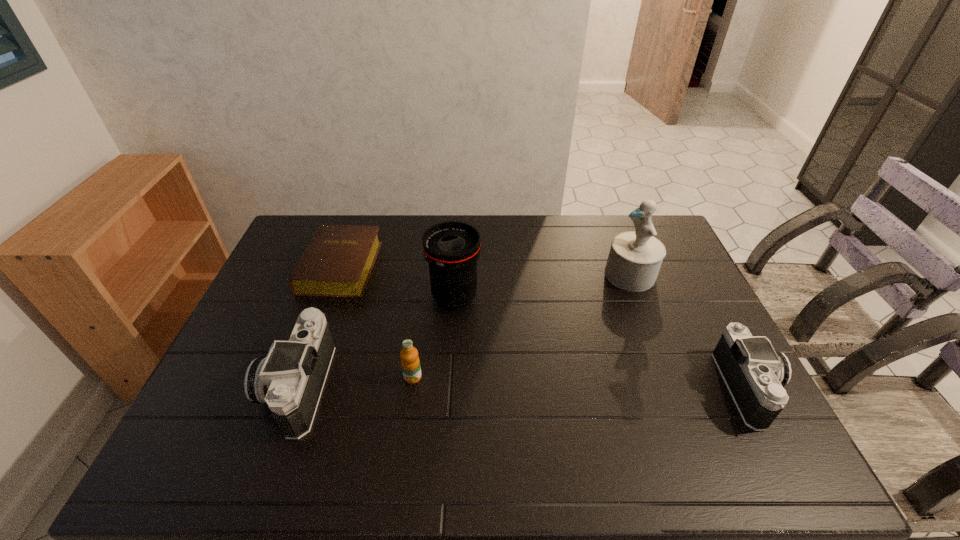
Please determine a free point for an extra camera to ensure balance. Please provide its 2D coordinates. Your answer should be formatted as a tuple, i.e. [(x, y)], where the tuple contains the x and y coordinates of a point satisfying the conditions above.

[(523, 387)]